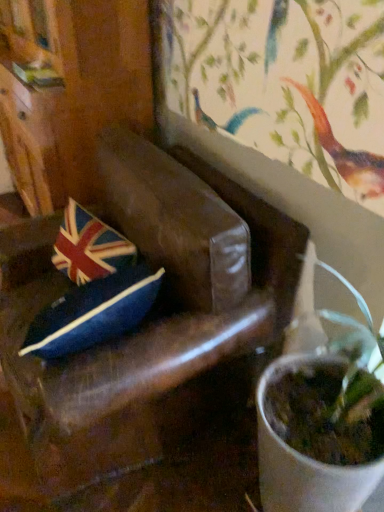
Question: From the image's perspective, is velvet union jack pillow at center positioned above or below brown leather chair at center?

Choices:
 (A) below
 (B) above

Answer: (B)

Question: In terms of width, does velvet union jack pillow at center look wider or thinner when compared to brown leather chair at center?

Choices:
 (A) thin
 (B) wide

Answer: (A)

Question: In terms of height, does velvet union jack pillow at center look taller or shorter compared to brown leather chair at center?

Choices:
 (A) tall
 (B) short

Answer: (B)

Question: Is brown leather chair at center bigger or smaller than velvet union jack pillow at center?

Choices:
 (A) small
 (B) big

Answer: (B)

Question: Is brown leather chair at center inside or outside of velvet union jack pillow at center?

Choices:
 (A) outside
 (B) inside

Answer: (A)

Question: From a real-world perspective, relative to velvet union jack pillow at center, is brown leather chair at center vertically above or below?

Choices:
 (A) above
 (B) below

Answer: (B)

Question: Considering the positions of point (79, 362) and point (82, 245), is point (79, 362) closer or farther from the camera than point (82, 245)?

Choices:
 (A) closer
 (B) farther

Answer: (A)